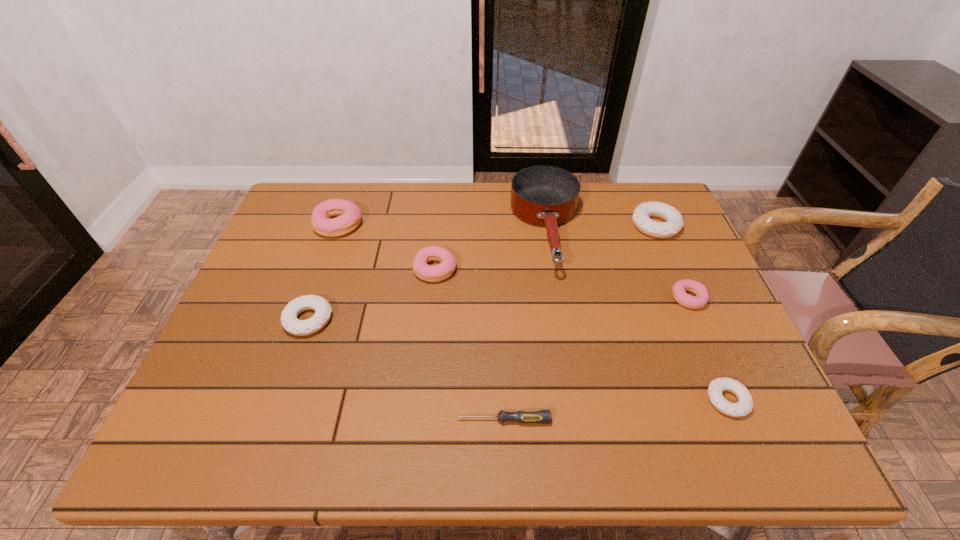
Identify which doughnut is located as the nearest to the screwdriver. Please provide its 2D coordinates. Your answer should be formatted as a tuple, i.e. [(x, y)], where the tuple contains the x and y coordinates of a point satisfying the conditions above.

[(744, 406)]

Find the location of a particular element. doughnut that stands as the closest to the sixth object from right to left is located at coordinates (349, 215).

Where is `pink doughnut that is the second closest one to the tallest object`? The height and width of the screenshot is (540, 960). pink doughnut that is the second closest one to the tallest object is located at coordinates (680, 287).

Where is `the closest pink doughnut to the leftmost white doughnut`? Image resolution: width=960 pixels, height=540 pixels. the closest pink doughnut to the leftmost white doughnut is located at coordinates (439, 272).

The width and height of the screenshot is (960, 540). I want to click on white doughnut object that ranks as the closest to the leftmost white doughnut, so click(x=744, y=406).

The width and height of the screenshot is (960, 540). Find the location of `white doughnut that is the second closest to the leftmost white doughnut`. white doughnut that is the second closest to the leftmost white doughnut is located at coordinates (674, 223).

Locate an element on the screen. The height and width of the screenshot is (540, 960). free location that satisfies the following two spatial constraints: 1. on the front side of the second farthest pink doughnut; 2. on the right side of the tallest doughnut is located at coordinates (324, 269).

Identify the location of vacant position in the image that satisfies the following two spatial constraints: 1. on the handle side of the brown pan; 2. on the left side of the shortest doughnut. Image resolution: width=960 pixels, height=540 pixels. (574, 400).

Identify the location of free space in the image that satisfies the following two spatial constraints: 1. on the front side of the second biggest white doughnut; 2. on the right side of the shortest doughnut. (281, 400).

You are a GUI agent. You are given a task and a screenshot of the screen. Output one action in this format:
    pyautogui.click(x=<x>, y=<y>)
    Task: Click on the vacant space that satisfies the following two spatial constraints: 1. on the handle side of the brown pan; 2. on the left side of the nearest pink doughnut
    The image size is (960, 540).
    Given the screenshot: What is the action you would take?
    pyautogui.click(x=558, y=299)